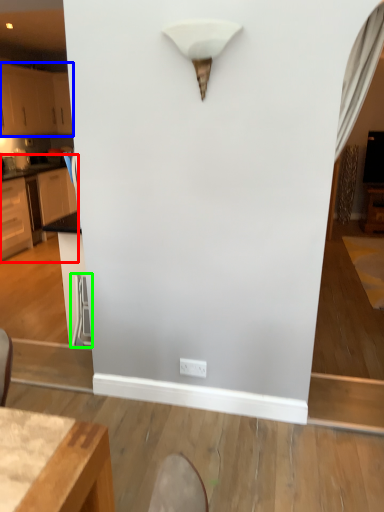
Question: Which object is positioned closest to cabinetry (highlighted by a red box)? Select from cabinetry (highlighted by a blue box) and swivel chair (highlighted by a green box).

Choices:
 (A) cabinetry
 (B) swivel chair

Answer: (A)